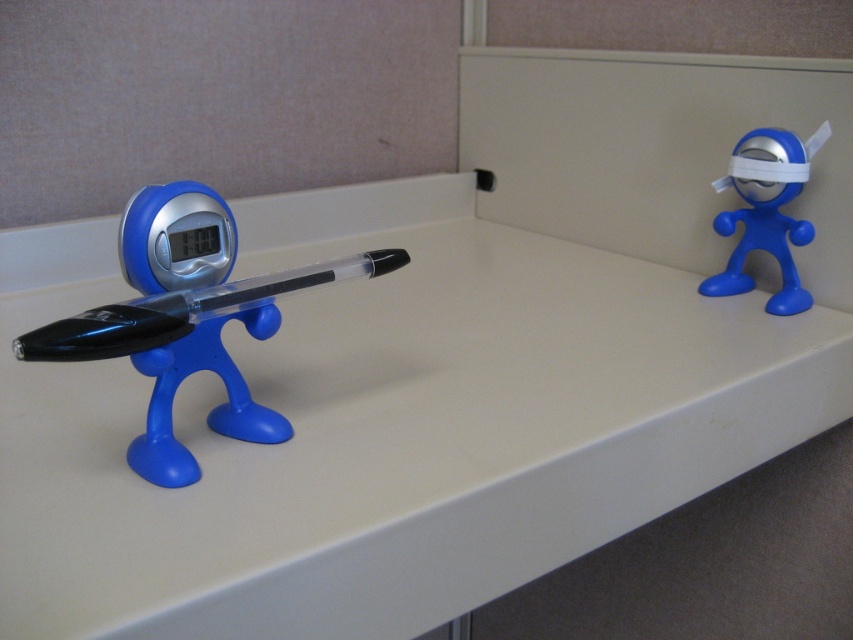
You are an artist planning to place a new sculpture between the transparent plastic pen at left and the blue bandaged figurine on the right. The sculpture is 18 inches long. Will it fit between them without overlapping?

The distance between the transparent plastic pen at left and the blue bandaged figurine on the right is 19.45 inches. Since the sculpture is 18 inches long, it will fit between them without overlapping.

You are organizing a desk and need to place the transparent plastic pen at left and the blue matte toy at right into a drawer. The drawer has a height limit of 10 cm. Can both items fit vertically without bending or damaging them?

The transparent plastic pen at left is bigger than blue matte toy at right, but since the question does not provide specific height measurements for either item, it is impossible to determine if they will fit within the 10 cm height limit. Additional information about their individual heights is required to make an accurate assessment.

You are organizing your desk and notice the matte plastic pen holder at left and the transparent plastic pen at left. Which object is located below the other?

The matte plastic pen holder at left is positioned under the transparent plastic pen at left, so the pen holder is below the pen.